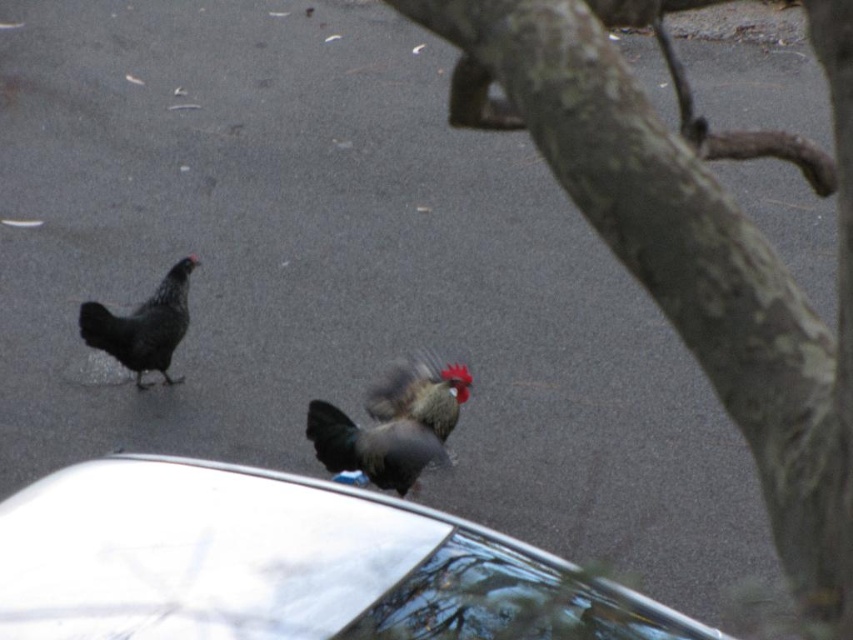
You are standing in front of the two chickens on the driveway. You notice two points marked on the ground. The first point is at coordinate point [508,548] and the second is at point [90,340]. Which point is closer to you?

Point [508,548] is closer to the viewer than point [90,340].

You are standing at the point closest to the camera in the image. There are two points marked in the scene, point (485, 106) and point (357, 451). If you want to walk towards the point that is further away from you, which point should you head towards?

Point (357, 451) is further away from the point (485, 106), so you should head towards point (357, 451).